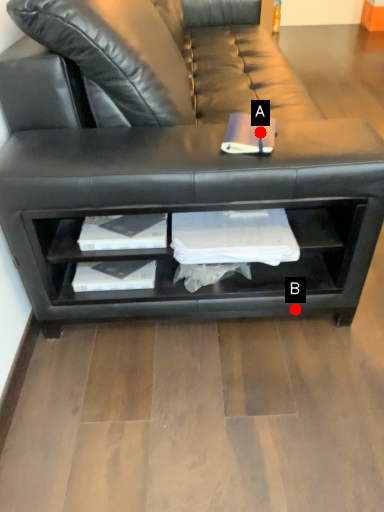
Question: Two points are circled on the image, labeled by A and B beside each circle. Which point is closer to the camera taking this photo?

Choices:
 (A) A is closer
 (B) B is closer

Answer: (A)